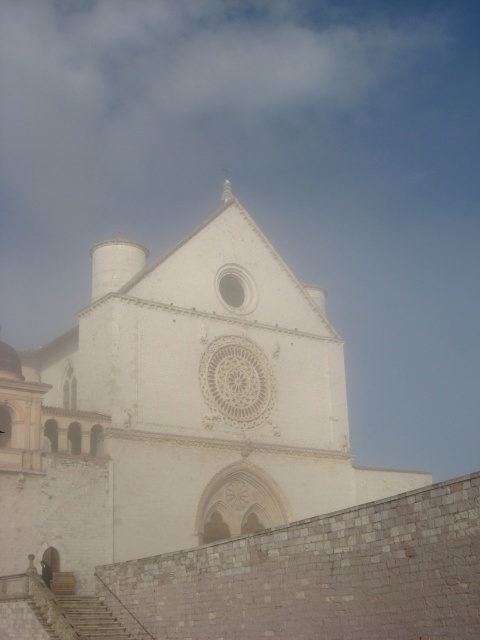
Question: Among these points, which one is nearest to the camera?

Choices:
 (A) (260, 396)
 (B) (314, 525)

Answer: (B)

Question: Does white stone church at center have a larger size compared to white stone clock at center?

Choices:
 (A) yes
 (B) no

Answer: (A)

Question: Estimate the real-world distances between objects in this image. Which object is farther from the white stone clock at center?

Choices:
 (A) white stone church at center
 (B) white stone spire at upper center

Answer: (B)

Question: Which object appears farthest from the camera in this image?

Choices:
 (A) white stone spire at upper center
 (B) white stone church at center

Answer: (A)

Question: Does white stone clock at center appear on the right side of white stone spire at upper center?

Choices:
 (A) no
 (B) yes

Answer: (B)

Question: Does white stone church at center come behind white stone clock at center?

Choices:
 (A) no
 (B) yes

Answer: (A)